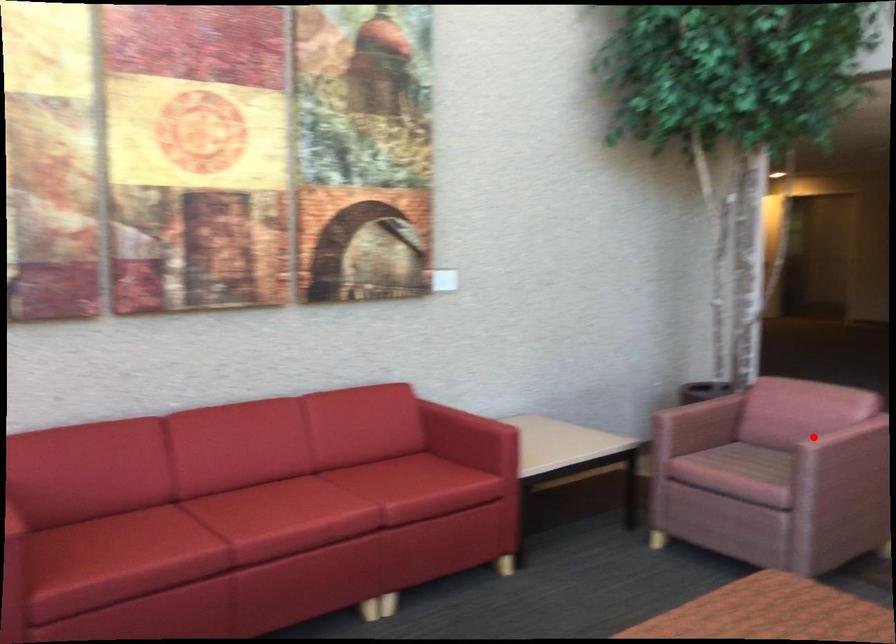
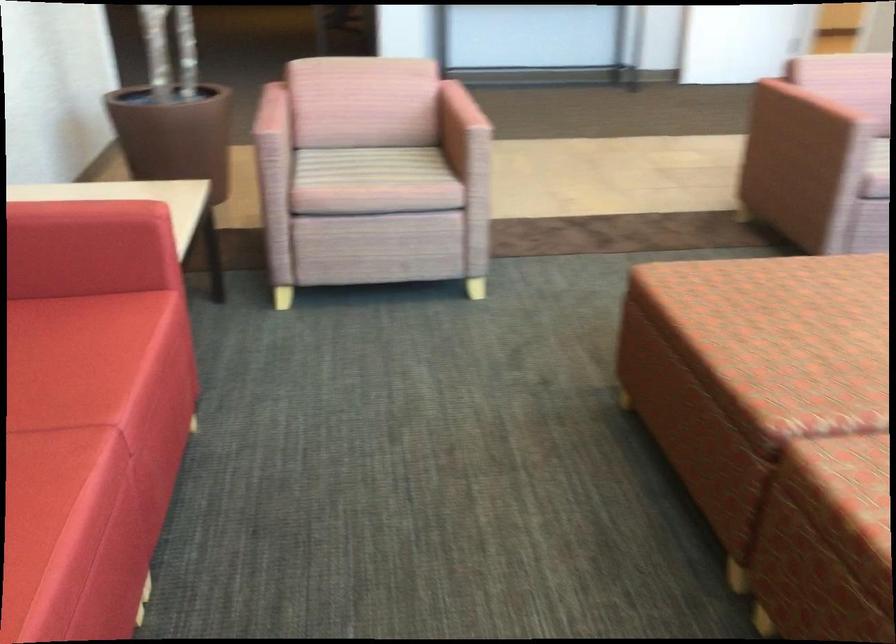
Question: I am providing you with two images of the same scene from different viewpoints. Given a red point in image1, look at the same physical point in image2. Is it:

Choices:
 (A) Closer to the viewpoint
 (B) Farther from the viewpoint

Answer: (A)